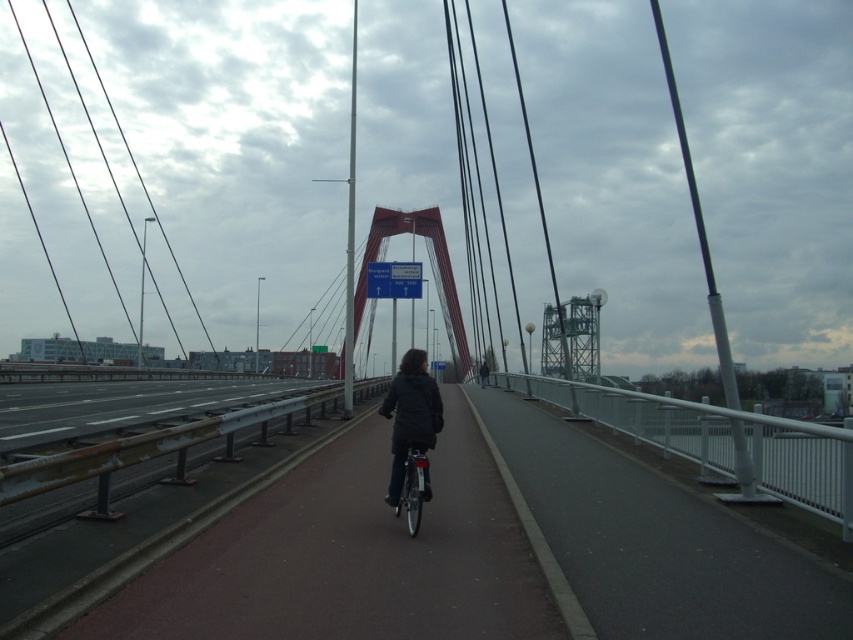
Is white plastic sign at center bigger than dark gray jacket at center?

Yes.

Measure the distance between white plastic sign at center and camera.

A distance of 39.16 meters exists between white plastic sign at center and camera.

Identify the location of white plastic sign at center. (393, 280).

This screenshot has height=640, width=853. What do you see at coordinates (410, 416) in the screenshot?
I see `dark matte jacket at center` at bounding box center [410, 416].

Does point (395, 460) come farther from viewer compared to point (419, 298)?

No, (395, 460) is closer to viewer.

Locate an element on the screen. Image resolution: width=853 pixels, height=640 pixels. dark matte jacket at center is located at coordinates (410, 416).

Which is behind, point (425, 358) or point (482, 362)?

Positioned behind is point (482, 362).

Between dark matte jacket at center and dark gray jacket at center, which one appears on the left side from the viewer's perspective?

dark matte jacket at center

Who is more forward, (407, 433) or (485, 381)?

Point (407, 433)

The height and width of the screenshot is (640, 853). I want to click on dark matte jacket at center, so click(x=410, y=416).